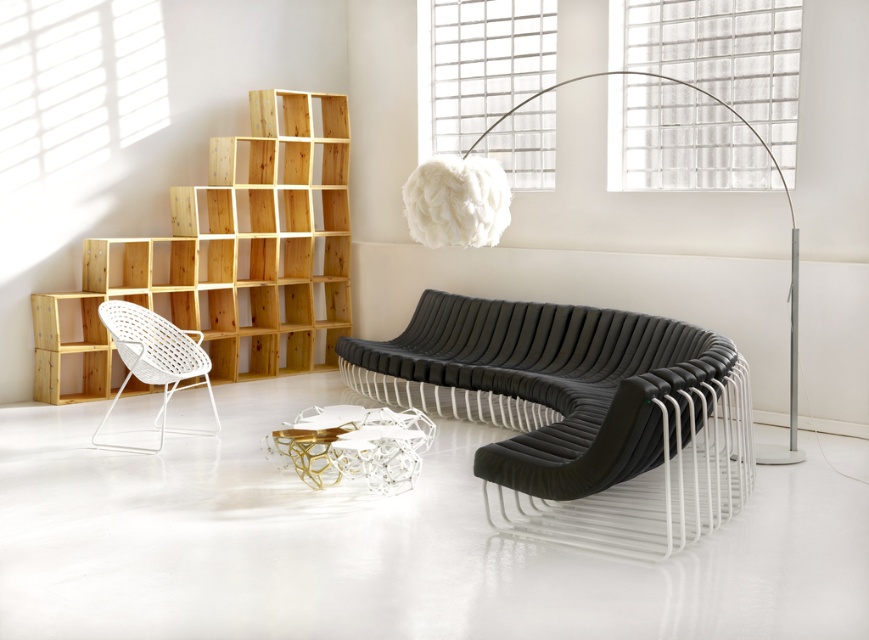
You are planning to move a 1.2 meter wide painting to the wall behind the natural wood bookshelf at left and the white woven armchair at left. Which object should you consider the width of to ensure the painting fits properly?

You should consider the width of the natural wood bookshelf at left because it might be wider than the white woven armchair at left, so ensuring the painting is wider than the bookshelf will guarantee it fits appropriately.

You are a delivery person trying to place a new coffee table that is 8 feet long in the living room. The black leather daybed at center and the white woven armchair at left are in the way. Can you fit the coffee table between them without moving any furniture?

The distance between the black leather daybed at center and the white woven armchair at left is 9.05 feet. Since the coffee table is 8 feet long, it can fit between them as there is enough space.